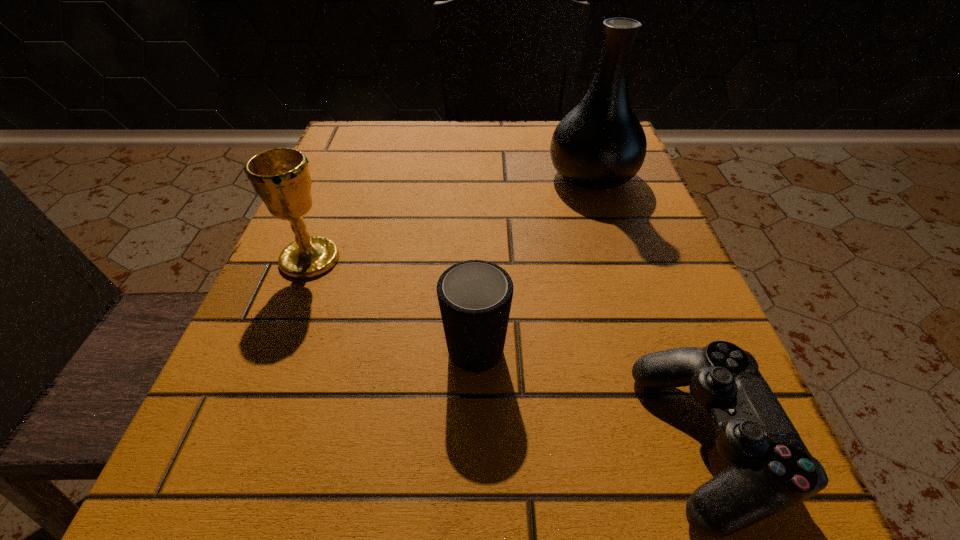
Locate an element on the screen. Image resolution: width=960 pixels, height=540 pixels. free spot that satisfies the following two spatial constraints: 1. on the side of the tallest object with the handle; 2. on the left side of the third object from right to left is located at coordinates (477, 176).

I want to click on free location that satisfies the following two spatial constraints: 1. on the side of the second object from left to right with the handle; 2. on the left side of the tallest object, so click(x=477, y=176).

Find the location of a particular element. vacant region that satisfies the following two spatial constraints: 1. on the side of the second shortest object with the handle; 2. on the right side of the farthest object is located at coordinates (477, 176).